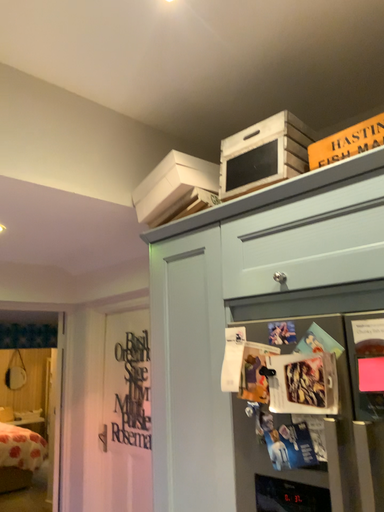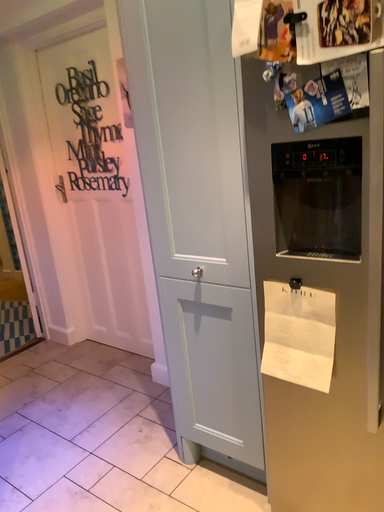
Question: How did the camera likely rotate when shooting the video?

Choices:
 (A) rotated upward
 (B) rotated downward

Answer: (B)